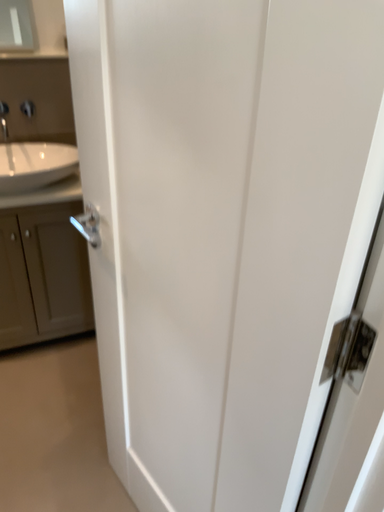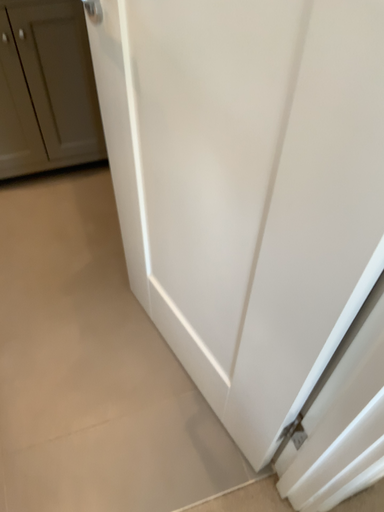
Question: How did the camera likely rotate when shooting the video?

Choices:
 (A) rotated upward
 (B) rotated downward

Answer: (B)